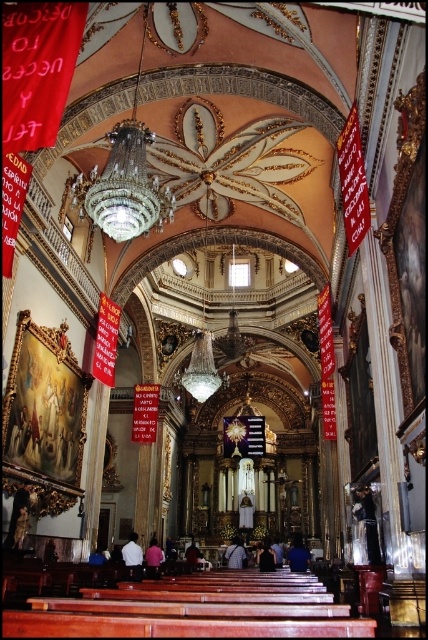
Question: Considering the real-world distances, which object is farthest from the dark blue shirt at center?

Choices:
 (A) white fabric shirt at center
 (B) white cotton shirt at center
 (C) pink fabric at lower center
 (D) dark blue fabric at center

Answer: (B)

Question: Can you confirm if white fabric shirt at center is positioned to the left of dark blue fabric at center?

Choices:
 (A) yes
 (B) no

Answer: (A)

Question: Does white cotton shirt at center lie behind pink fabric at lower center?

Choices:
 (A) no
 (B) yes

Answer: (A)

Question: Does pink fabric at lower center have a lesser width compared to white fabric shirt at center?

Choices:
 (A) no
 (B) yes

Answer: (A)

Question: Which of the following is the farthest from the observer?

Choices:
 (A) dark blue fabric at center
 (B) pink fabric at lower center
 (C) dark blue shirt at center
 (D) white fabric shirt at center

Answer: (C)

Question: Among these objects, which one is farthest from the camera?

Choices:
 (A) pink fabric at lower center
 (B) dark blue fabric at center

Answer: (B)